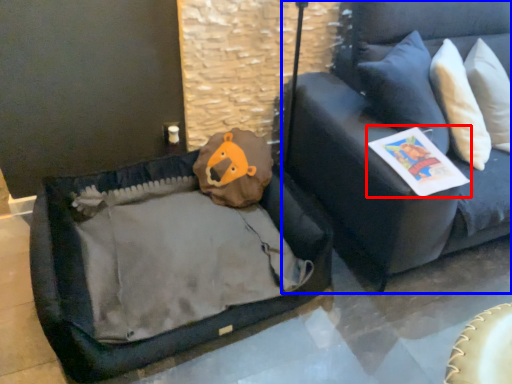
Question: Among these objects, which one is nearest to the camera, magazine (highlighted by a red box) or studio couch (highlighted by a blue box)?

Choices:
 (A) magazine
 (B) studio couch

Answer: (B)